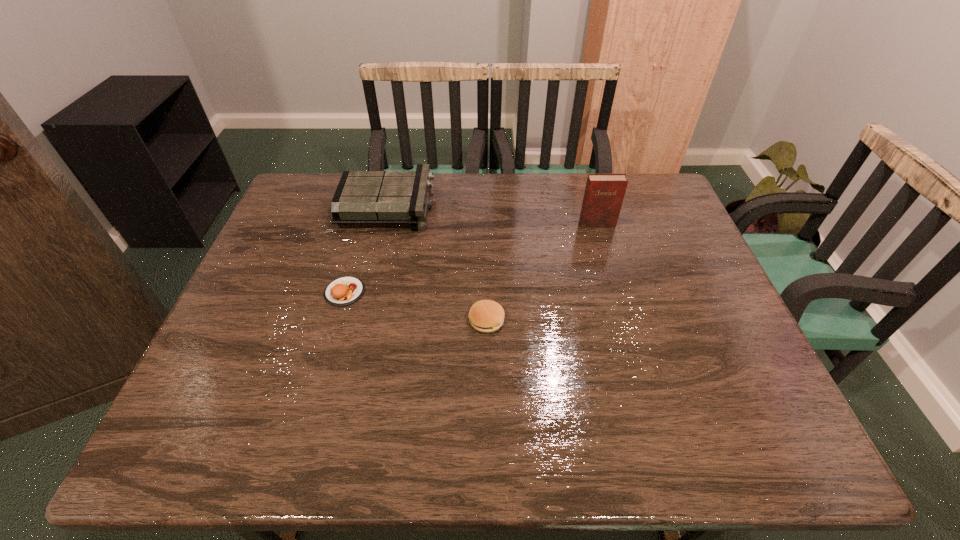
This screenshot has width=960, height=540. In order to click on vacant space situated on the front of the shorter patty (food) in this screenshot , I will do `click(310, 411)`.

I want to click on object that is at the far edge, so click(362, 197).

Identify the location of free spot at the far edge of the desktop. The width and height of the screenshot is (960, 540). (502, 207).

The height and width of the screenshot is (540, 960). In the image, there is a desktop. In order to click on blank space at the near edge in this screenshot , I will do `click(490, 423)`.

Locate an element on the screen. The image size is (960, 540). vacant space at the left edge is located at coordinates (274, 227).

Image resolution: width=960 pixels, height=540 pixels. I want to click on vacant space at the right edge, so click(x=674, y=274).

Locate an element on the screen. This screenshot has height=540, width=960. blank space at the far left corner of the desktop is located at coordinates (317, 211).

At what (x,y) coordinates should I click in order to perform the action: click on free space at the near left corner of the desktop. Please return your answer as a coordinate pair (x, y). The width and height of the screenshot is (960, 540). Looking at the image, I should click on click(x=195, y=421).

Locate an element on the screen. free space at the far right corner of the desktop is located at coordinates (660, 202).

This screenshot has height=540, width=960. Find the location of `free space at the near right corner of the desktop`. free space at the near right corner of the desktop is located at coordinates (763, 440).